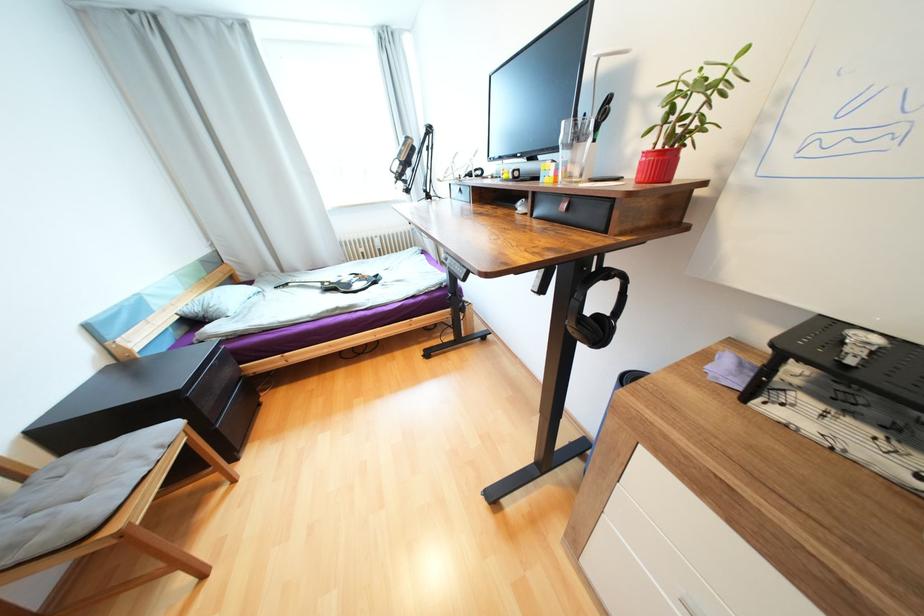
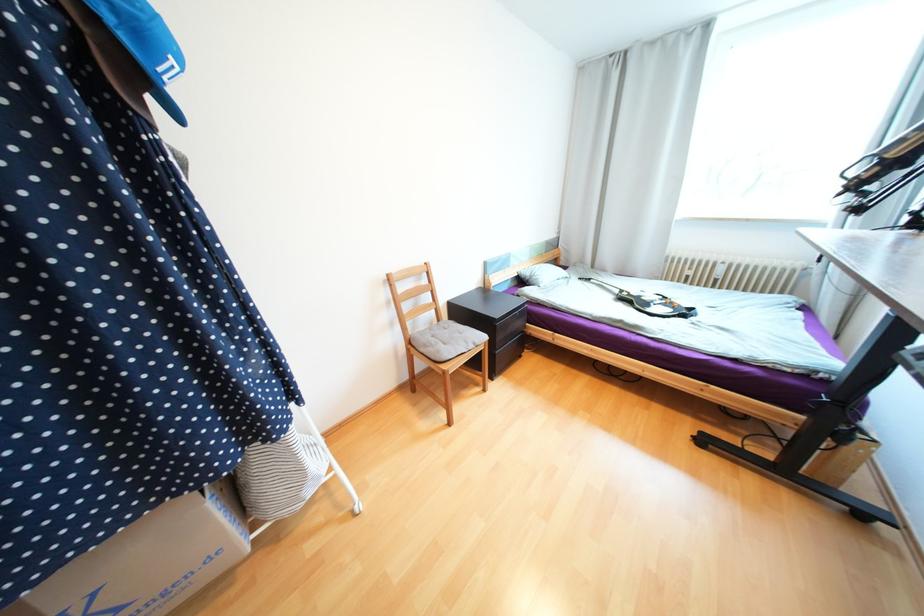
In the second image, find the point that corresponds to the point at 147,458 in the first image.

(472, 342)